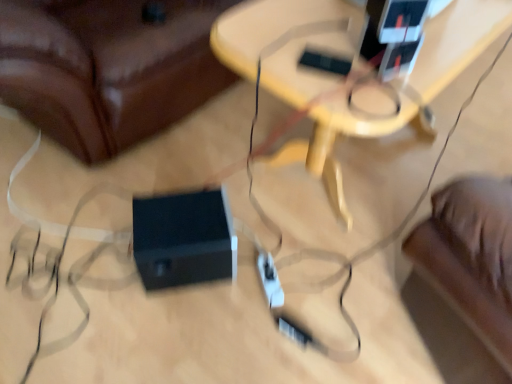
I want to click on wooden table at center, so click(285, 44).

Image resolution: width=512 pixels, height=384 pixels. Describe the element at coordinates (184, 239) in the screenshot. I see `black plastic speaker at lower center` at that location.

At what (x,y) coordinates should I click in order to perform the action: click on black plastic speaker at lower center. Please return your answer as a coordinate pair (x, y). This screenshot has width=512, height=384. Looking at the image, I should click on (108, 68).

Measure the distance between black plastic speaker at lower center and black plastic speaker at lower center.

They are 19.56 inches apart.

Is black plastic speaker at lower center inside the boundaries of black plastic speaker at lower center, or outside?

black plastic speaker at lower center exists outside the volume of black plastic speaker at lower center.

From the image's perspective, is black plastic speaker at lower center beneath black plastic speaker at lower center?

Incorrect, from the image's perspective, black plastic speaker at lower center is higher than black plastic speaker at lower center.

Does point (151, 59) lie in front of point (220, 271)?

No, (151, 59) is behind (220, 271).

Considering the relative positions of wooden table at center and black plastic speaker at lower center in the image provided, is wooden table at center in front of black plastic speaker at lower center?

A: Yes, wooden table at center is in front of black plastic speaker at lower center.

Considering the relative sizes of wooden table at center and black plastic speaker at lower center in the image provided, is wooden table at center wider than black plastic speaker at lower center?

Yes.

From a real-world perspective, between wooden table at center and black plastic speaker at lower center, who is vertically lower?

black plastic speaker at lower center.

Are black plastic speaker at lower center and wooden table at center making contact?

black plastic speaker at lower center and wooden table at center are not in contact.

Is black plastic speaker at lower center oriented towards wooden table at center?

Yes, black plastic speaker at lower center faces towards wooden table at center.

Is wooden table at center surrounded by black plastic speaker at lower center?

No, wooden table at center is located outside of black plastic speaker at lower center.

Which object is further away from the camera taking this photo, wooden table at center or black plastic speaker at lower center?

wooden table at center is further from the camera.

How much distance is there between wooden table at center and black plastic speaker at lower center?

wooden table at center and black plastic speaker at lower center are 19.62 inches apart.

Which is closer to the camera, (221, 47) or (190, 14)?

Point (221, 47)

What are the coordinates of `table that appears below the black plastic speaker at lower center (from the image's perspective)` in the screenshot? It's located at (285, 44).

Is point (209, 216) farther from camera compared to point (106, 41)?

No, it is not.

How different are the orientations of black plastic speaker at lower center and black plastic speaker at lower center in degrees?

The facing directions of black plastic speaker at lower center and black plastic speaker at lower center are 53.1 degrees apart.

Is black plastic speaker at lower center bigger than black plastic speaker at lower center?

No, black plastic speaker at lower center is not bigger than black plastic speaker at lower center.

From the image's perspective, between black plastic speaker at lower center and black plastic speaker at lower center, who is located below?

black plastic speaker at lower center is shown below in the image.

Could you tell me if black plastic speaker at lower center is turned towards wooden table at center?

Yes, black plastic speaker at lower center is facing wooden table at center.

Does black plastic speaker at lower center have a larger size compared to wooden table at center?

Yes, black plastic speaker at lower center is bigger than wooden table at center.

Is point (29, 48) closer or farther from the camera than point (332, 203)?

Point (29, 48) appears to be closer to the viewer than point (332, 203).

Is black plastic speaker at lower center not close to wooden table at center?

black plastic speaker at lower center is near wooden table at center, not far away.

Where is `furniture above the black plastic speaker at lower center (from the image's perspective)`? furniture above the black plastic speaker at lower center (from the image's perspective) is located at coordinates (108, 68).

At what (x,y) coordinates should I click in order to perform the action: click on speaker located underneath the wooden table at center (from a real-world perspective). Please return your answer as a coordinate pair (x, y). This screenshot has width=512, height=384. Looking at the image, I should click on (184, 239).

From the image, which object appears to be nearer to black plastic speaker at lower center, black plastic speaker at lower center or wooden table at center?

black plastic speaker at lower center lies closer to black plastic speaker at lower center than the other object.

Looking at the image, which one is located closer to black plastic speaker at lower center, black plastic speaker at lower center or wooden table at center?

Among the two, black plastic speaker at lower center is located nearer to black plastic speaker at lower center.

When comparing their distances from black plastic speaker at lower center, does wooden table at center or black plastic speaker at lower center seem further?

wooden table at center lies further to black plastic speaker at lower center than the other object.

Consider the image. When comparing their distances from black plastic speaker at lower center, does wooden table at center or black plastic speaker at lower center seem closer?

black plastic speaker at lower center.

Consider the image. Estimate the real-world distances between objects in this image. Which object is further from wooden table at center, black plastic speaker at lower center or black plastic speaker at lower center?

black plastic speaker at lower center is further to wooden table at center.

When comparing their distances from wooden table at center, does black plastic speaker at lower center or black plastic speaker at lower center seem closer?

black plastic speaker at lower center is positioned closer to the anchor wooden table at center.

In order to click on table that lies between black plastic speaker at lower center and black plastic speaker at lower center from top to bottom in this screenshot , I will do `click(285, 44)`.